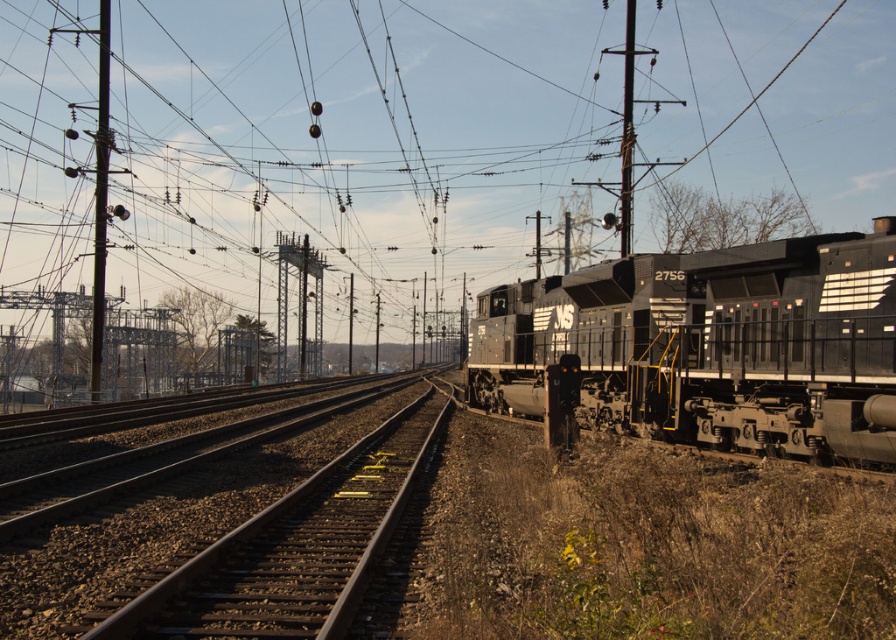
Question: Which of the following is the farthest from the observer?

Choices:
 (A) metallic pole at center
 (B) brown gravel track at center
 (C) matte black locomotive at center
 (D) metallic gray pole at left

Answer: (D)

Question: In this image, where is metallic gray pole at left located relative to metallic pole at center?

Choices:
 (A) below
 (B) above

Answer: (A)

Question: Which object appears farthest from the camera in this image?

Choices:
 (A) brown gravel track at center
 (B) metallic pole at center
 (C) metallic gray pole at left

Answer: (C)

Question: Does matte black locomotive at center appear under brown gravel track at center?

Choices:
 (A) no
 (B) yes

Answer: (A)

Question: Where is metallic gray pole at left located in relation to metallic pole at center in the image?

Choices:
 (A) below
 (B) above

Answer: (A)

Question: Which object is closer to the camera taking this photo?

Choices:
 (A) metallic pole at center
 (B) matte black locomotive at center
 (C) brown gravel track at center

Answer: (C)